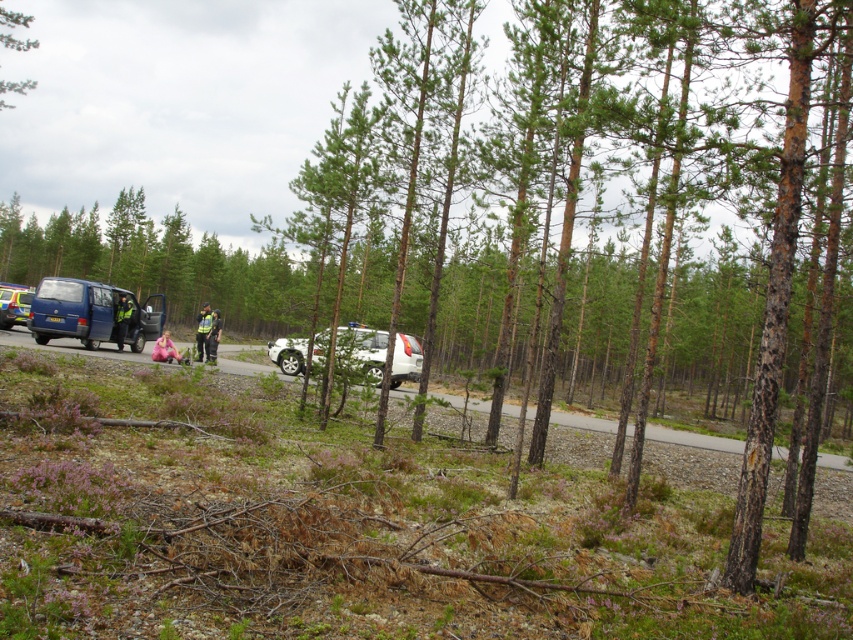
Question: Which of the following is the closest to the observer?

Choices:
 (A) (770, 339)
 (B) (204, 321)

Answer: (A)

Question: Does metallic blue van at left have a smaller size compared to dark blue uniform at left?

Choices:
 (A) no
 (B) yes

Answer: (A)

Question: Where is white plastic bag at center located in relation to dark blue uniform at left in the image?

Choices:
 (A) right
 (B) left

Answer: (A)

Question: Which object appears farthest from the camera in this image?

Choices:
 (A) blue matte van at left
 (B) reflective silver helmet at center
 (C) white plastic bag at center
 (D) green leafy tree at upper left

Answer: (B)

Question: Which object appears farthest from the camera in this image?

Choices:
 (A) brown rough tree at center
 (B) blue matte van at left
 (C) white matte suv at center
 (D) reflective yellow vest at center

Answer: (D)

Question: Is blue matte van at left further to camera compared to dark blue uniform at left?

Choices:
 (A) yes
 (B) no

Answer: (B)